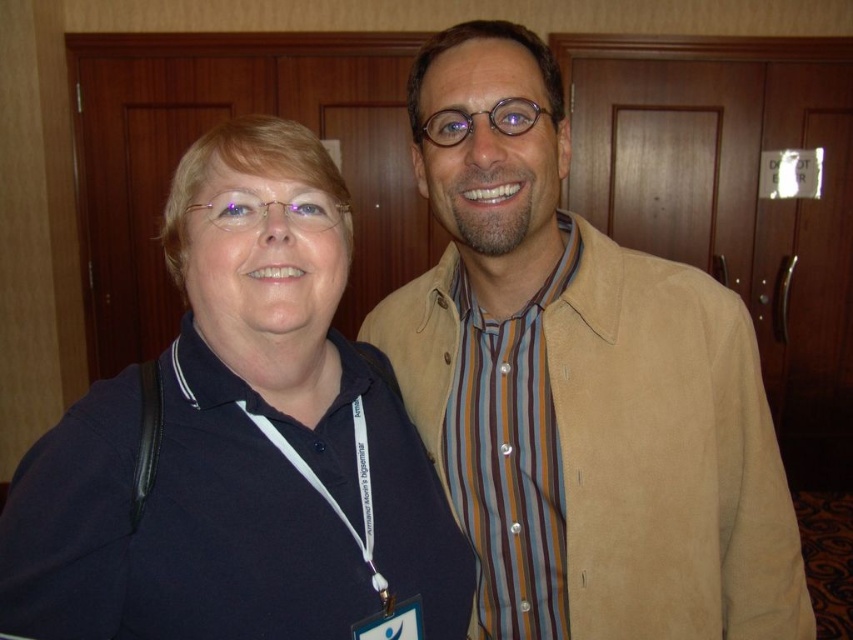
Question: Can you confirm if matte black polo shirt at left is bigger than striped fabric shirt at right?

Choices:
 (A) no
 (B) yes

Answer: (B)

Question: Does matte black polo shirt at left appear on the left side of striped fabric shirt at right?

Choices:
 (A) yes
 (B) no

Answer: (A)

Question: Which point is closer to the camera?

Choices:
 (A) suede jacket at center
 (B) matte black polo shirt at left
 (C) striped fabric shirt at right

Answer: (B)

Question: Estimate the real-world distances between objects in this image. Which object is closer to the striped fabric shirt at right?

Choices:
 (A) suede jacket at center
 (B) matte black polo shirt at left

Answer: (A)

Question: Which point appears closest to the camera in this image?

Choices:
 (A) (485, 433)
 (B) (218, 337)
 (C) (512, 365)

Answer: (B)

Question: Is matte black polo shirt at left smaller than striped fabric shirt at right?

Choices:
 (A) no
 (B) yes

Answer: (A)